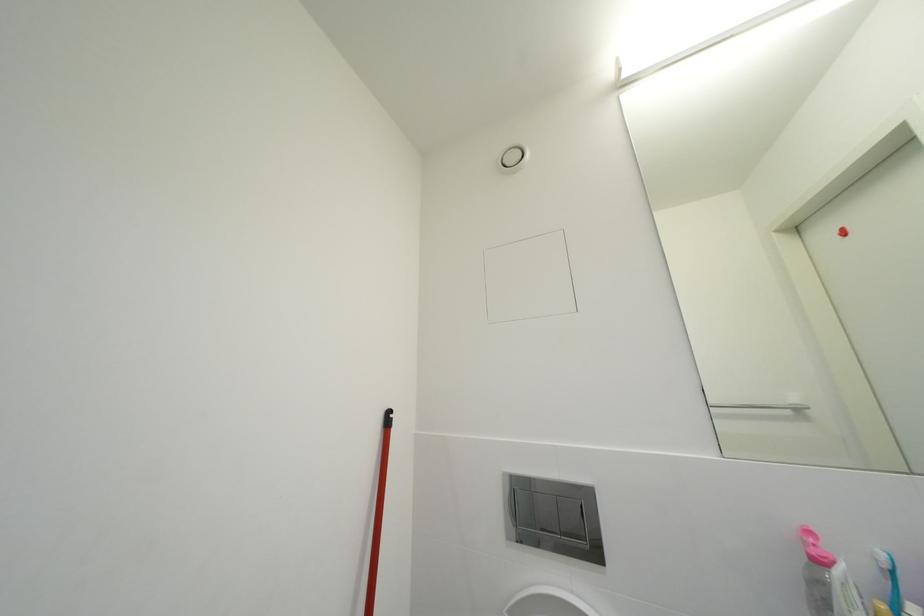
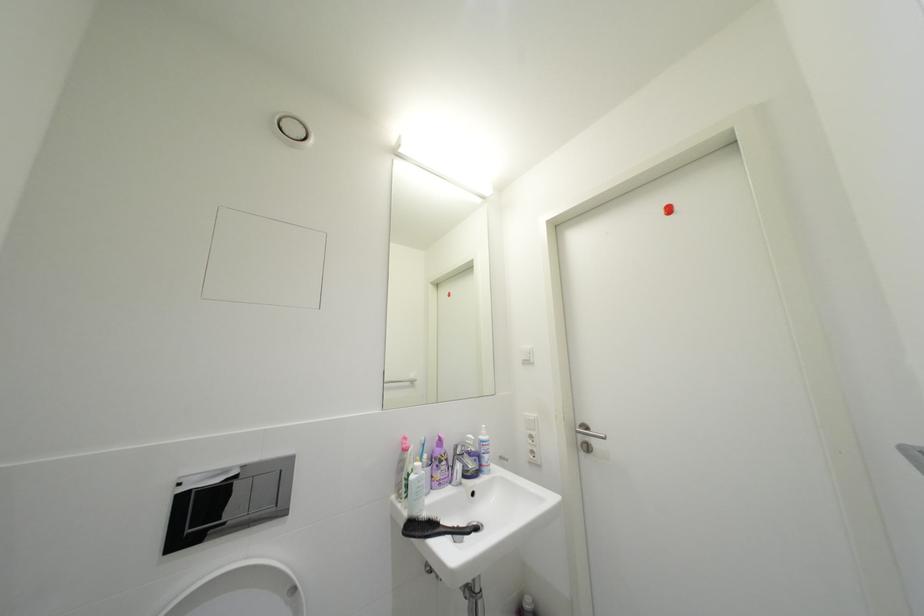
Question: The camera is either moving clockwise (left) or counter-clockwise (right) around the object. The first image is from the beginning of the video and the second image is from the end. Is the camera moving left or right when shooting the video?

Choices:
 (A) Left
 (B) Right

Answer: (A)